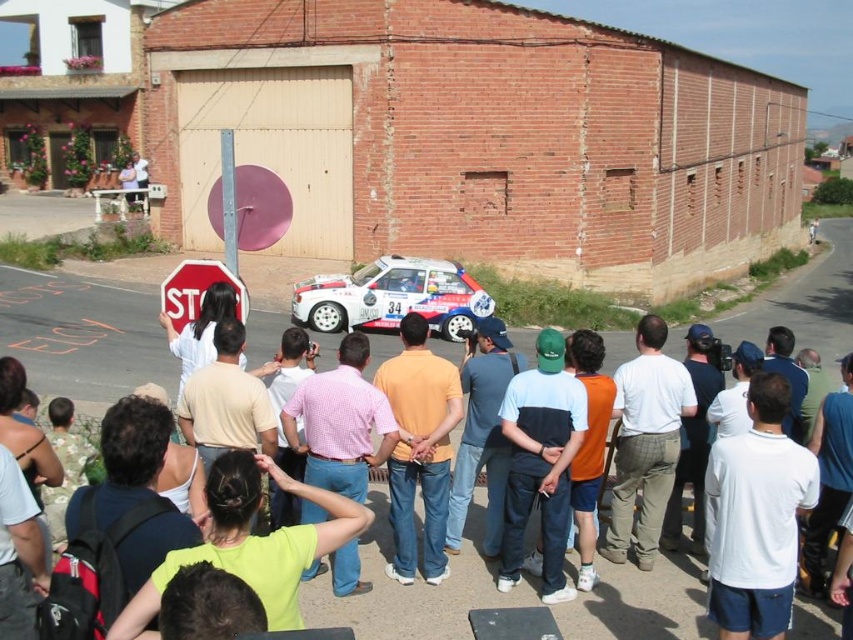
Does orange cotton shirt at center appear under pink checkered shirt at center?

Yes, orange cotton shirt at center is below pink checkered shirt at center.

Is point (421, 328) in front of point (381, 419)?

No, (421, 328) is behind (381, 419).

Which is behind, point (428, 488) or point (322, 449)?

Point (428, 488)

Locate an element on the screen. This screenshot has height=640, width=853. orange cotton shirt at center is located at coordinates (419, 449).

Is orange cotton shirt at center positioned in front of red matte stop sign at center?

Yes, orange cotton shirt at center is in front of red matte stop sign at center.

In the scene shown: Does orange cotton shirt at center appear under red matte stop sign at center?

Correct, orange cotton shirt at center is located below red matte stop sign at center.

Does point (378, 384) come closer to viewer compared to point (221, 266)?

Yes, it is in front of point (221, 266).

Image resolution: width=853 pixels, height=640 pixels. I want to click on orange cotton shirt at center, so click(419, 449).

Between point (560, 620) and point (509, 490), which one is positioned in front?

Point (560, 620) is in front.

Where is `white cotton shirt at center`? This screenshot has width=853, height=640. white cotton shirt at center is located at coordinates (80, 339).